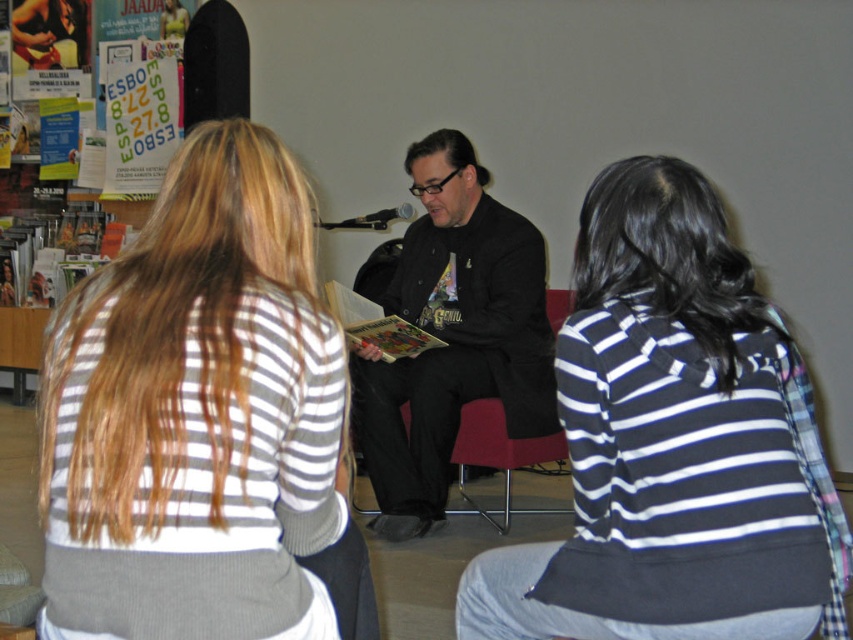
Is striped sweater at center taller than black and white striped sweater at center?

No.

Can you confirm if striped sweater at center is positioned above black and white striped sweater at center?

Correct, striped sweater at center is located above black and white striped sweater at center.

Is point (140, 618) positioned before point (601, 468)?

Yes, it is.

This screenshot has height=640, width=853. In order to click on striped sweater at center in this screenshot , I will do `click(201, 419)`.

Looking at this image, is black and white striped sweater at center positioned before matte black jacket at center?

Yes, black and white striped sweater at center is closer to the viewer.

Can you confirm if black and white striped sweater at center is positioned to the left of matte black jacket at center?

In fact, black and white striped sweater at center is to the right of matte black jacket at center.

The width and height of the screenshot is (853, 640). I want to click on black and white striped sweater at center, so click(672, 444).

Locate an element on the screen. Image resolution: width=853 pixels, height=640 pixels. black and white striped sweater at center is located at coordinates (672, 444).

Is point (260, 600) positioned behind point (422, 486)?

No, (260, 600) is in front of (422, 486).

Does striped sweater at center have a lesser height compared to matte black jacket at center?

Yes.

Which is in front, point (132, 481) or point (451, 298)?

Point (132, 481) is more forward.

The image size is (853, 640). I want to click on striped sweater at center, so click(201, 419).